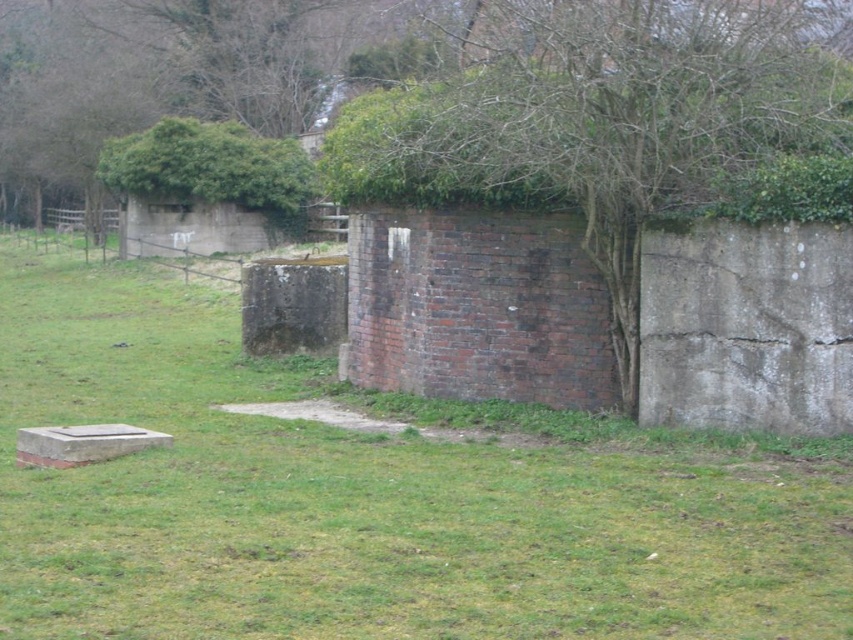
You are standing at the center of the grassy area and want to take a photo of the green leafy tree at upper right. Which direction should you face to ensure the tree is in the frame?

The green leafy tree at upper right is located at point coordinates, so you should face towards the upper right direction to capture it in your photo.

You are standing in the outdoor scene described. You need to place a small garden statue that requires a space wider than the green leafy hedge at upper left. Can the green grassy at lower left accommodate it?

The green grassy at lower left might be wider than green leafy hedge at upper left, so it could potentially accommodate the garden statue if the required width is met.

You are planning to install a bird feeder in the outdoor area shown. The bird feeder requires a sturdy branch that can support its weight. Based on the scene, which object between the green leafy tree at upper right and the green leafy hedge at upper left is more likely to have such a branch?

The green leafy tree at upper right is larger in size than the green leafy hedge at upper left, so it is more likely to have sturdy branches capable of supporting the bird feeder.